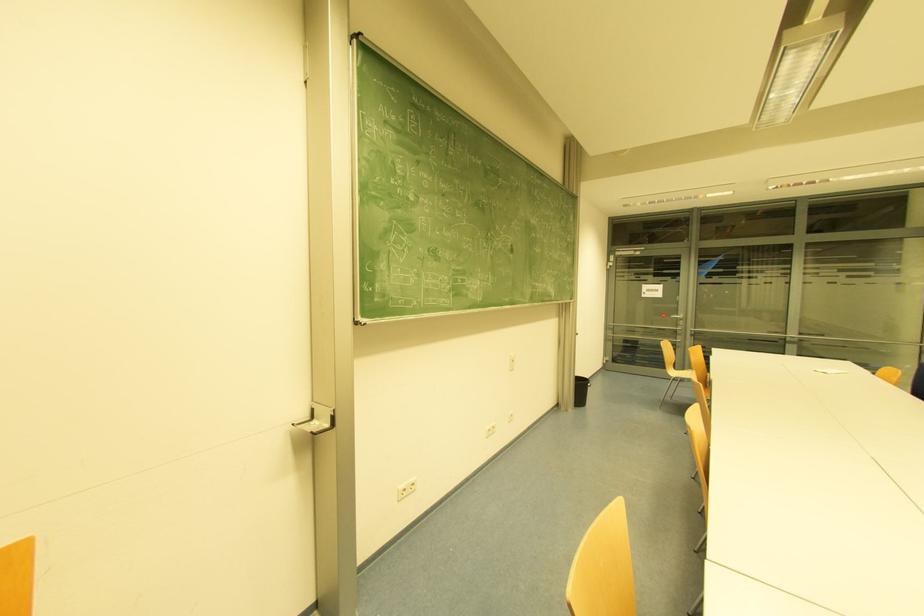
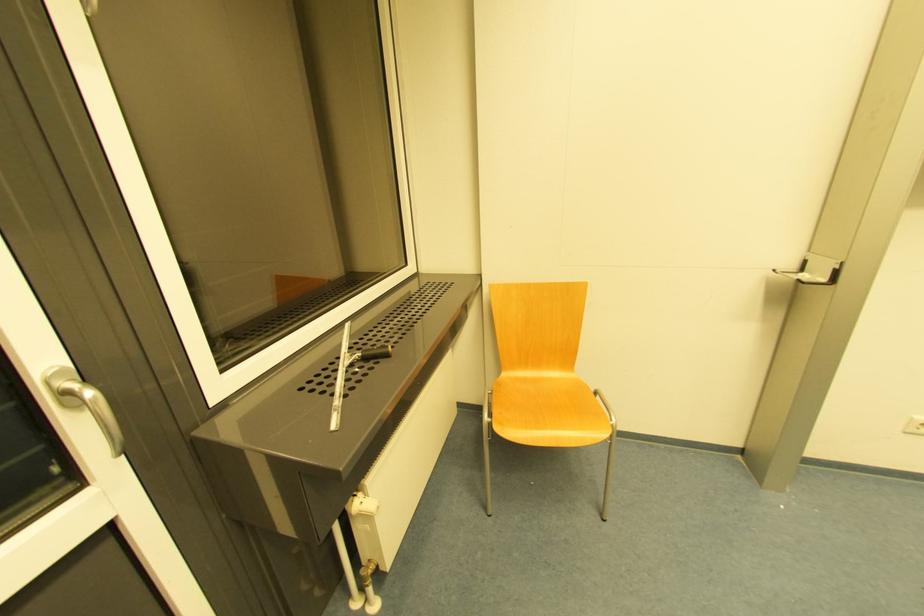
How did the camera likely rotate?

The camera's rotation is toward left-down.